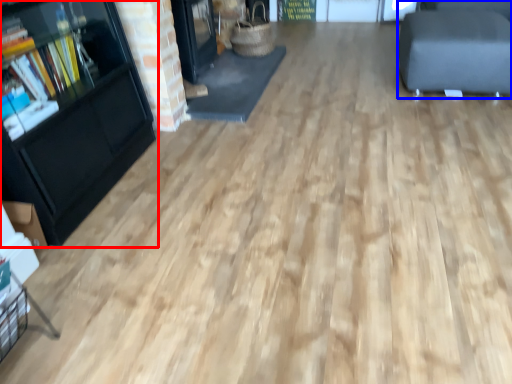
Question: Which of the following is the closest to the observer, bookcase (highlighted by a red box) or furniture (highlighted by a blue box)?

Choices:
 (A) bookcase
 (B) furniture

Answer: (A)